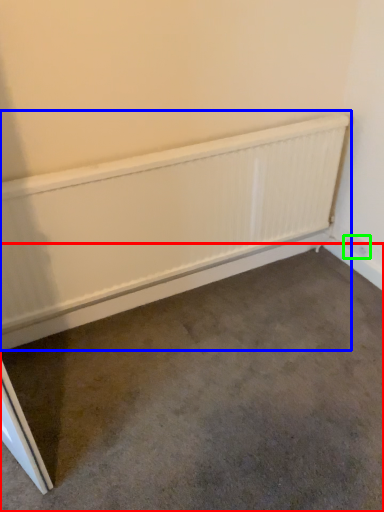
Question: Which object is positioned closest to concrete (highlighted by a red box)? Select from radiator (highlighted by a blue box) and electric outlet (highlighted by a green box).

Choices:
 (A) radiator
 (B) electric outlet

Answer: (A)